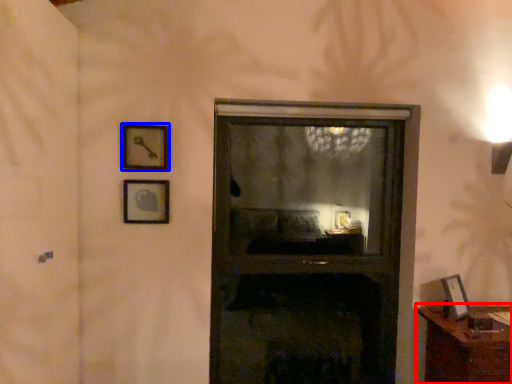
Question: Which point is further to the camera, furniture (highlighted by a red box) or picture frame (highlighted by a blue box)?

Choices:
 (A) furniture
 (B) picture frame

Answer: (B)